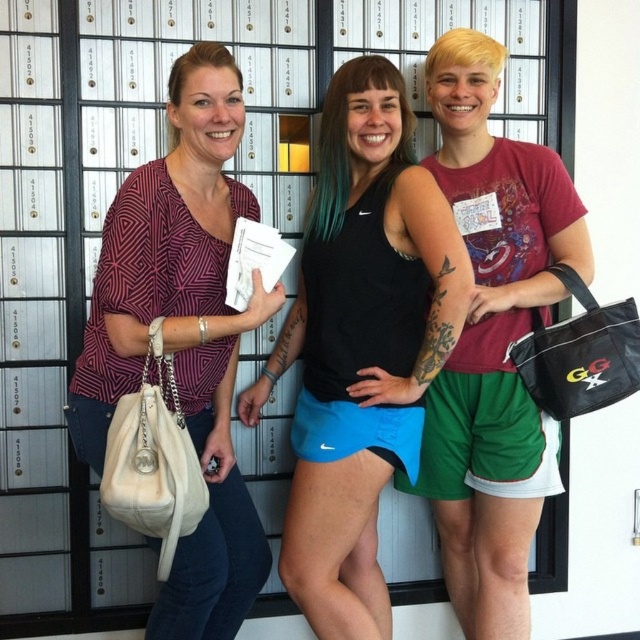
Between point (348, 536) and point (500, 304), which one is positioned in front?

Point (348, 536)

Measure the distance between black matte tank top at center and camera.

black matte tank top at center is 1.67 meters away from camera.

You are a GUI agent. You are given a task and a screenshot of the screen. Output one action in this format:
    pyautogui.click(x=<x>, y=<y>)
    Task: Click on the black matte tank top at center
    Image resolution: width=640 pixels, height=640 pixels.
    Given the screenshot: What is the action you would take?
    pyautogui.click(x=362, y=340)

Is point (294, 436) closer to camera compared to point (196, 340)?

No, it is not.

Who is more forward, (342, 260) or (205, 241)?

Point (205, 241)

The image size is (640, 640). Identify the location of black matte tank top at center. (362, 340).

Does matte red shorts at center appear on the right side of matte black purse at left?

Indeed, matte red shorts at center is positioned on the right side of matte black purse at left.

Who is more forward, (500,548) or (186,243)?

Point (186,243) is in front.

At what (x,y) coordinates should I click in order to perform the action: click on matte red shorts at center. Please return your answer as a coordinate pair (x, y). Image resolution: width=640 pixels, height=640 pixels. Looking at the image, I should click on (492, 340).